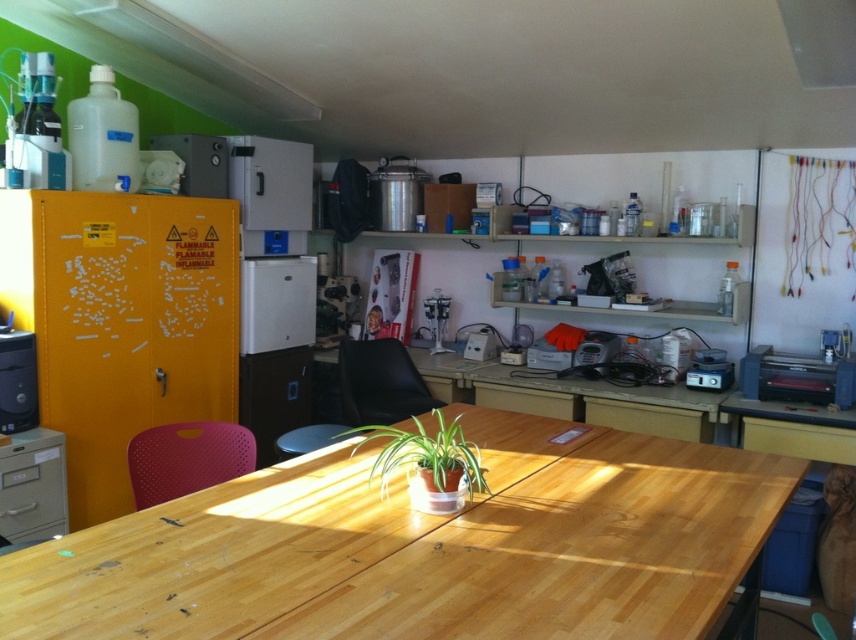
Looking at this image, is natural wood table at center below matte black computer tower at left?

Yes.

Looking at this image, does natural wood table at center appear over matte black computer tower at left?

No, natural wood table at center is not above matte black computer tower at left.

Is point (516, 417) more distant than point (27, 344)?

Yes, point (516, 417) is farther from viewer.

Locate an element on the screen. natural wood table at center is located at coordinates (423, 547).

Who is higher up, natural wood table at center or black leather chair at center?

black leather chair at center is higher up.

Is point (165, 580) closer to viewer compared to point (342, 378)?

Yes, point (165, 580) is closer to viewer.

Where is `natural wood table at center`? This screenshot has width=856, height=640. natural wood table at center is located at coordinates (423, 547).

I want to click on white matte refrigerator at center, so click(276, 301).

Which is in front, point (302, 342) or point (193, 189)?

Point (193, 189) is in front.

Measure the distance between white matte refrigerator at center and camera.

white matte refrigerator at center and camera are 3.80 meters apart from each other.

Image resolution: width=856 pixels, height=640 pixels. What are the coordinates of `white matte refrigerator at center` in the screenshot? It's located at (276, 301).